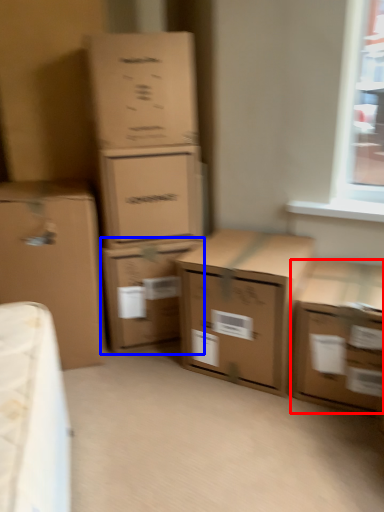
Question: Which object appears closest to the camera in this image, box (highlighted by a red box) or box (highlighted by a blue box)?

Choices:
 (A) box
 (B) box

Answer: (A)